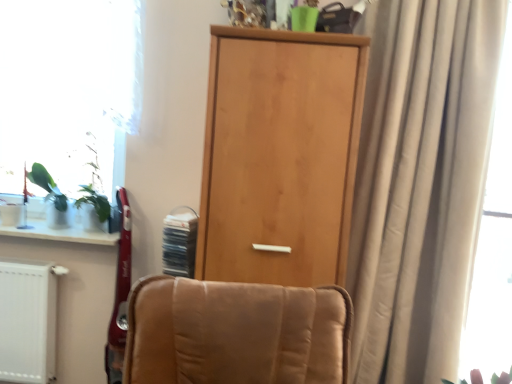
What is the approximate height of light wood door at center?

light wood door at center is 3.74 feet tall.

Where is `beige fabric curtain at right`? The height and width of the screenshot is (384, 512). beige fabric curtain at right is located at coordinates point(420,183).

Does translucent fabric curtain at right have a greater height compared to transparent glass window at left?

Yes, translucent fabric curtain at right is taller than transparent glass window at left.

Is translucent fabric curtain at right inside the boundaries of transparent glass window at left, or outside?

translucent fabric curtain at right is outside transparent glass window at left.

Visually, is translucent fabric curtain at right positioned to the left or to the right of transparent glass window at left?

From the image, it's evident that translucent fabric curtain at right is to the right of transparent glass window at left.

Is translucent fabric curtain at right facing away from transparent glass window at left?

No.

Is transparent glass window at left beside translucent fabric curtain at right?

transparent glass window at left and translucent fabric curtain at right are not in contact.

Is transparent glass window at left positioned with its back to translucent fabric curtain at right?

transparent glass window at left does not have its back to translucent fabric curtain at right.

From a real-world perspective, who is located lower, transparent glass window at left or translucent fabric curtain at right?

translucent fabric curtain at right, from a real-world perspective.

Is transparent glass window at left completely or partially outside of translucent fabric curtain at right?

transparent glass window at left lies outside translucent fabric curtain at right's area.

From a real-world perspective, is translucent fabric curtain at right physically located above or below light wood door at center?

From a real-world perspective, translucent fabric curtain at right is physically above light wood door at center.

The image size is (512, 384). What are the coordinates of `window screen to the right of light wood door at center` in the screenshot? It's located at (494, 243).

Is translucent fabric curtain at right not within light wood door at center?

Absolutely, translucent fabric curtain at right is external to light wood door at center.

Does translucent fabric curtain at right appear on the left side of light wood door at center?

In fact, translucent fabric curtain at right is to the right of light wood door at center.

Considering the positions of objects translucent fabric curtain at right and beige fabric curtain at right in the image provided, who is more to the left, translucent fabric curtain at right or beige fabric curtain at right?

Positioned to the left is beige fabric curtain at right.

Consider the image. Is translucent fabric curtain at right turned away from beige fabric curtain at right?

No.

Which object is wider, translucent fabric curtain at right or beige fabric curtain at right?

With larger width is beige fabric curtain at right.

Does point (509, 111) come behind point (467, 5)?

Yes, point (509, 111) is farther from viewer.

From a real-world perspective, between white glossy window sill at lower left and translucent fabric curtain at right, who is vertically higher?

From a 3D spatial view, translucent fabric curtain at right is above.

Does point (63, 229) lie in front of point (511, 74)?

No.

Between white glossy window sill at lower left and translucent fabric curtain at right, which one appears on the left side from the viewer's perspective?

Positioned to the left is white glossy window sill at lower left.

Is white glossy window sill at lower left facing towards translucent fabric curtain at right?

No, white glossy window sill at lower left is not aimed at translucent fabric curtain at right.

Considering the positions of point (82, 240) and point (272, 83), is point (82, 240) closer or farther from the camera than point (272, 83)?

Point (82, 240) is farther from the camera than point (272, 83).

Can you confirm if white glossy window sill at lower left is positioned to the right of light wood door at center?

Incorrect, white glossy window sill at lower left is not on the right side of light wood door at center.

From the image's perspective, relative to light wood door at center, is white glossy window sill at lower left above or below?

white glossy window sill at lower left is situated lower than light wood door at center in the image.

How many degrees apart are the facing directions of beige fabric curtain at right and translucent fabric curtain at right?

They differ by 5.71e-05 degrees in their facing directions.

Is beige fabric curtain at right to the right of translucent fabric curtain at right from the viewer's perspective?

No, beige fabric curtain at right is not to the right of translucent fabric curtain at right.

In terms of height, does beige fabric curtain at right look taller or shorter compared to translucent fabric curtain at right?

beige fabric curtain at right is taller than translucent fabric curtain at right.

At what (x,y) coordinates should I click in order to perform the action: click on curtain below the translucent fabric curtain at right (from the image's perspective). Please return your answer as a coordinate pair (x, y). Looking at the image, I should click on (420, 183).

The width and height of the screenshot is (512, 384). In order to click on window screen behind the transparent glass window at left in this screenshot , I will do `click(494, 243)`.

Identify the location of window screen on the right of transparent glass window at left. The width and height of the screenshot is (512, 384). (494, 243).

When comparing their distances from light wood door at center, does beige fabric curtain at right or translucent fabric curtain at right seem closer?

Based on the image, beige fabric curtain at right appears to be nearer to light wood door at center.

Which object lies nearer to the anchor point beige fabric curtain at right, light wood door at center or transparent glass window at left?

light wood door at center.

From the image, which object appears to be nearer to beige fabric curtain at right, transparent glass window at left or translucent fabric curtain at right?

translucent fabric curtain at right is closer to beige fabric curtain at right.

Based on their spatial positions, is white glossy window sill at lower left or light wood door at center further from beige fabric curtain at right?

white glossy window sill at lower left.

Consider the image. Estimate the real-world distances between objects in this image. Which object is further from transparent glass window at left, white glossy window sill at lower left or light wood door at center?

The object further to transparent glass window at left is light wood door at center.

Considering their positions, is white glossy window sill at lower left positioned further to light wood door at center than transparent glass window at left?

white glossy window sill at lower left is further to light wood door at center.

Estimate the real-world distances between objects in this image. Which object is further from white glossy window sill at lower left, beige fabric curtain at right or transparent glass window at left?

beige fabric curtain at right is further to white glossy window sill at lower left.

Which object lies further to the anchor point beige fabric curtain at right, white glossy window sill at lower left or translucent fabric curtain at right?

Based on the image, white glossy window sill at lower left appears to be further to beige fabric curtain at right.

You are a GUI agent. You are given a task and a screenshot of the screen. Output one action in this format:
    pyautogui.click(x=<x>, y=<y>)
    Task: Click on the door between white glossy window sill at lower left and beige fabric curtain at right in the horizontal direction
    This screenshot has height=384, width=512.
    Given the screenshot: What is the action you would take?
    pyautogui.click(x=280, y=155)

The width and height of the screenshot is (512, 384). Find the location of `door situated between white glossy window sill at lower left and translucent fabric curtain at right from left to right`. door situated between white glossy window sill at lower left and translucent fabric curtain at right from left to right is located at coordinates (280, 155).

The image size is (512, 384). Identify the location of curtain between light wood door at center and translucent fabric curtain at right. (420, 183).

Find the location of `window between white glossy window sill at lower left and translucent fabric curtain at right from left to right`. window between white glossy window sill at lower left and translucent fabric curtain at right from left to right is located at coordinates (68, 89).